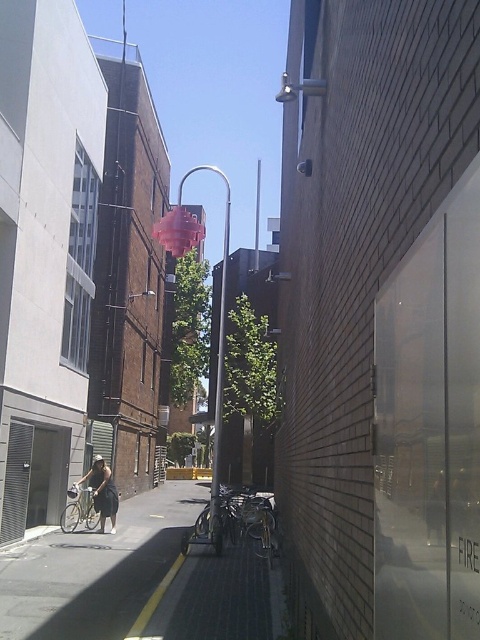
Question: Which point is farther to the camera?

Choices:
 (A) (104, 468)
 (B) (130, 545)
 (C) (218, 330)

Answer: (C)

Question: Among these points, which one is farthest from the camera?

Choices:
 (A) (73, 522)
 (B) (219, 444)
 (C) (83, 536)

Answer: (A)

Question: Does metallic pole at center have a greater width compared to dark gray dress at center?

Choices:
 (A) no
 (B) yes

Answer: (B)

Question: Does pink translucent lamp post at center have a greater width compared to silver metallic bicycle at lower left?

Choices:
 (A) yes
 (B) no

Answer: (A)

Question: Is pink translucent lamp post at center behind metallic pole at center?

Choices:
 (A) no
 (B) yes

Answer: (A)

Question: Which object appears farthest from the camera in this image?

Choices:
 (A) dark gray dress at center
 (B) pink translucent lamp post at center
 (C) metallic pole at center
 (D) dark gray concrete pavement at center

Answer: (A)